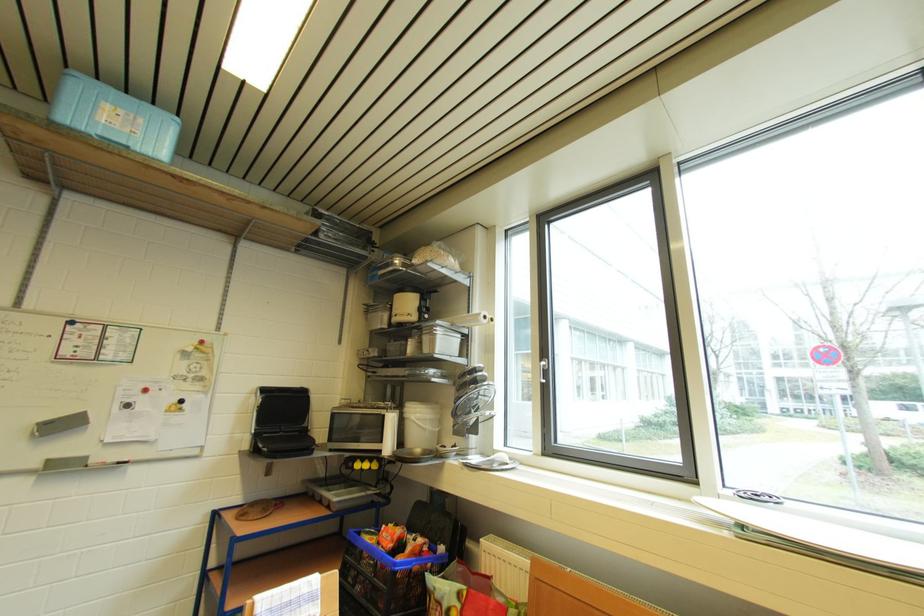
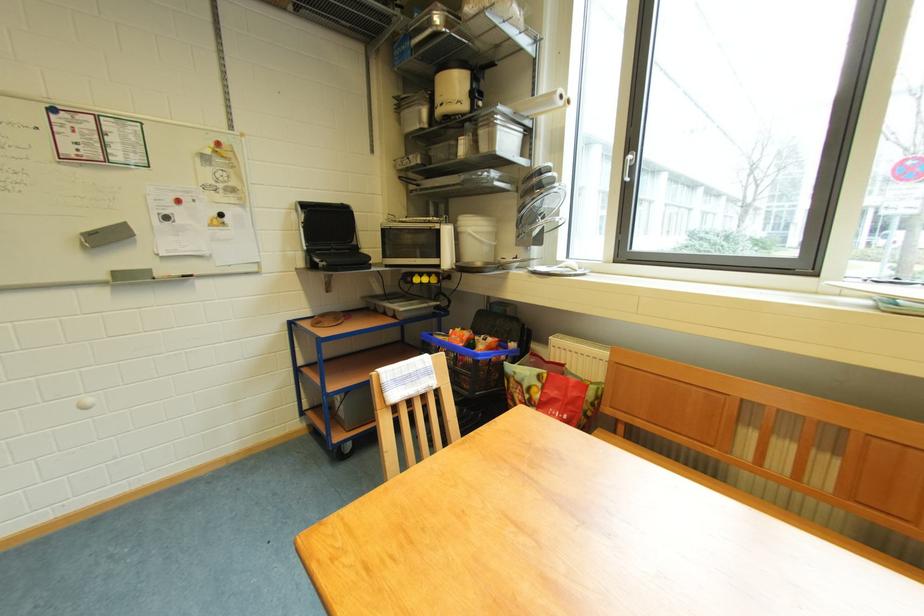
Where in the second image is the point corresponding to point (546, 369) from the first image?

(634, 161)